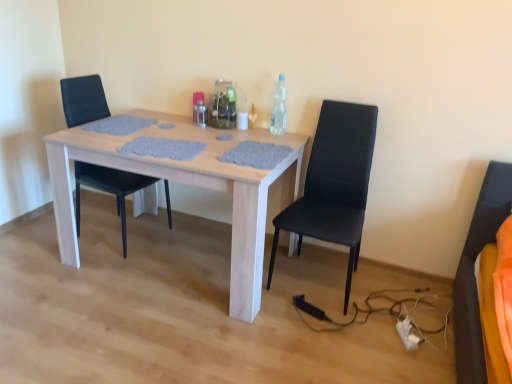
You are a GUI agent. You are given a task and a screenshot of the screen. Output one action in this format:
    pyautogui.click(x=<x>, y=<y>)
    Task: Click on the vacant space that's between black leather chair at right, which is counted as the 1th chair, starting from the right, and white fabric extension cord at lower right
    The height and width of the screenshot is (384, 512).
    Given the screenshot: What is the action you would take?
    pyautogui.click(x=369, y=316)